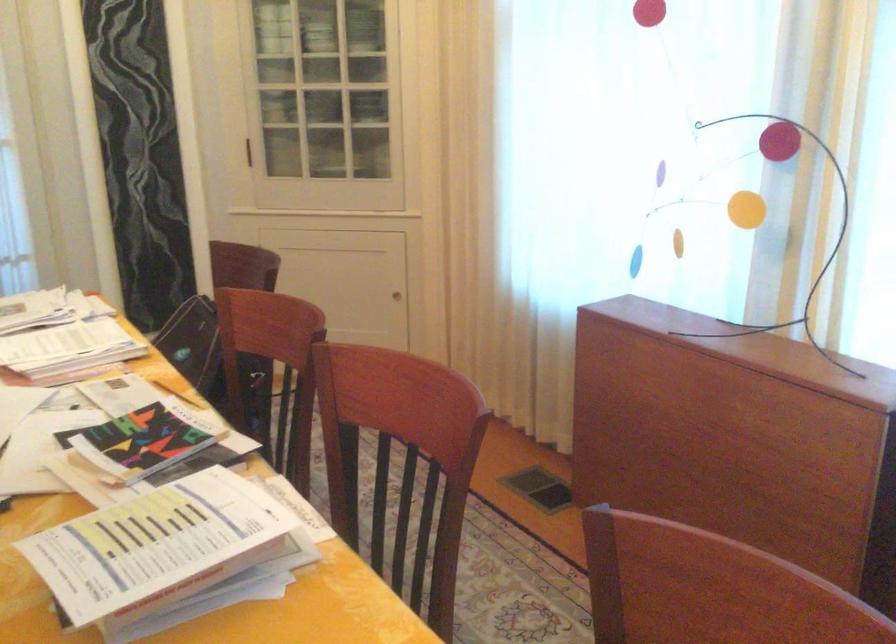
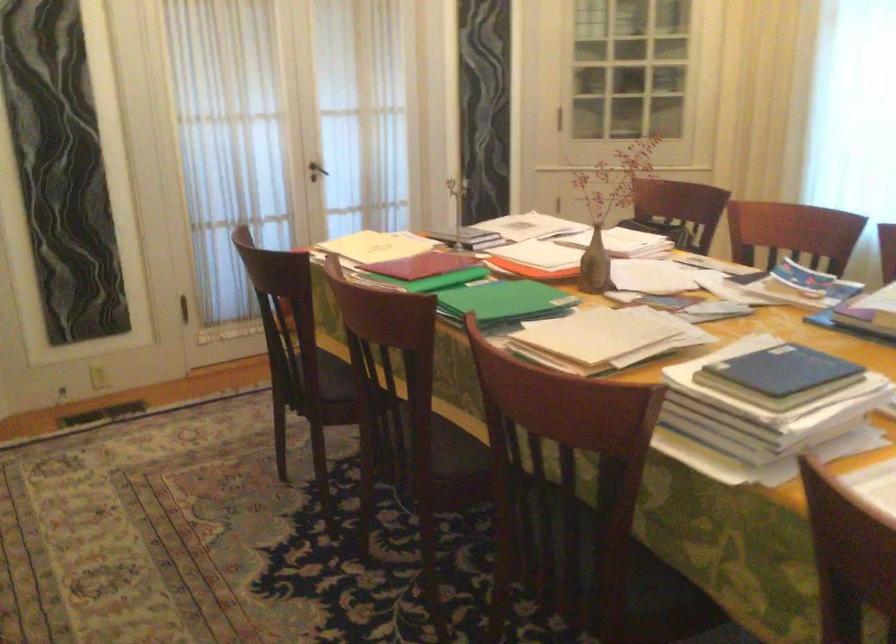
Question: I am providing you with two images of the same scene from different viewpoints. After the viewpoint changes to image2, which objects are now occluded?

Choices:
 (A) small cabinet knob
 (B) black digital clock
 (C) chair sitting surface
 (D) yellow folder

Answer: (A)